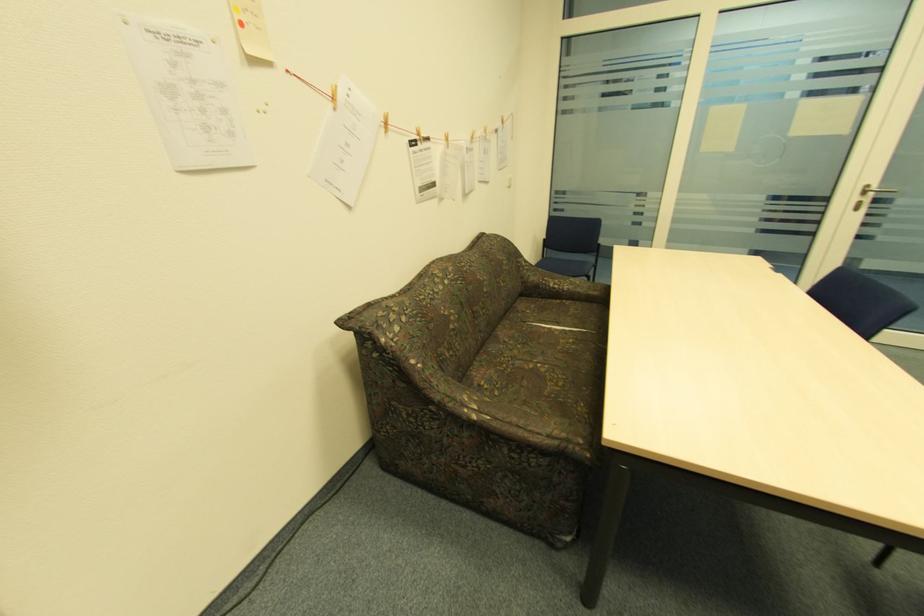
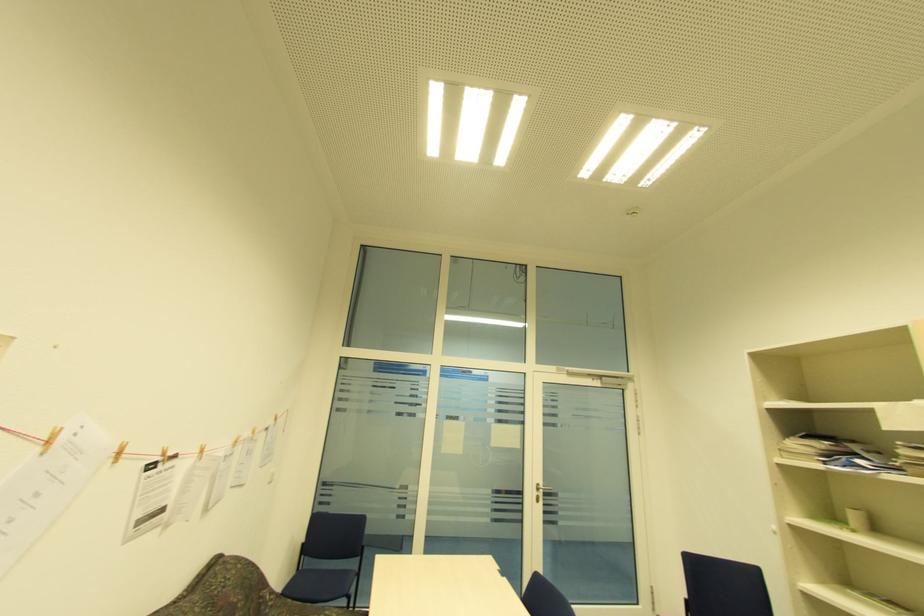
Find the pixel in the second image that matches (859,199) in the first image.

(538, 493)